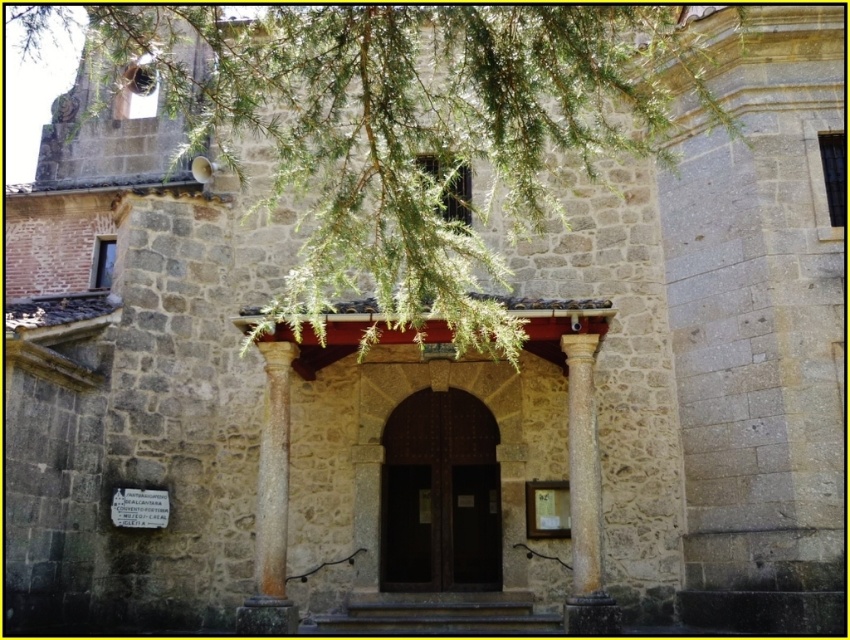
Looking at this image, you are standing at the entrance of the stone structure and notice a green leafy branch at upper center and a smooth stone column at center. Which object is taller?

The green leafy branch at upper center is taller than the smooth stone column at center.

You are an architect assessing the entrance of this historical building. You need to determine if the dark wood door at center can be replaced with a larger door without altering the smooth stone column at center. Based on their sizes, is this feasible?

The dark wood door at center is smaller than the smooth stone column at center, so replacing it with a larger door may not be feasible without adjusting the column or the door frame, since the column is currently larger and might restrict the space available for a wider door.

You are a painter who needs to know which object is shorter between the dark wood door at center and the sandy brown stone column at center. Can you tell me?

The dark wood door at center is shorter than the sandy brown stone column at center.